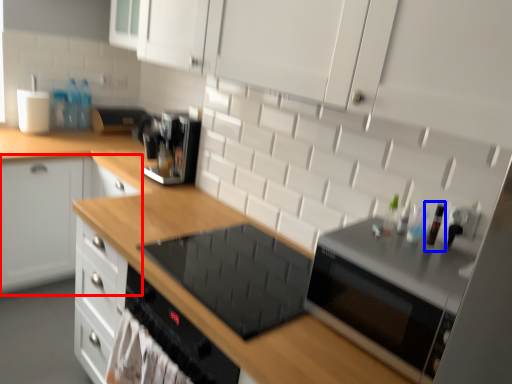
Question: Which point is further to the camera, cabinetry (highlighted by a red box) or bottle (highlighted by a blue box)?

Choices:
 (A) cabinetry
 (B) bottle

Answer: (A)